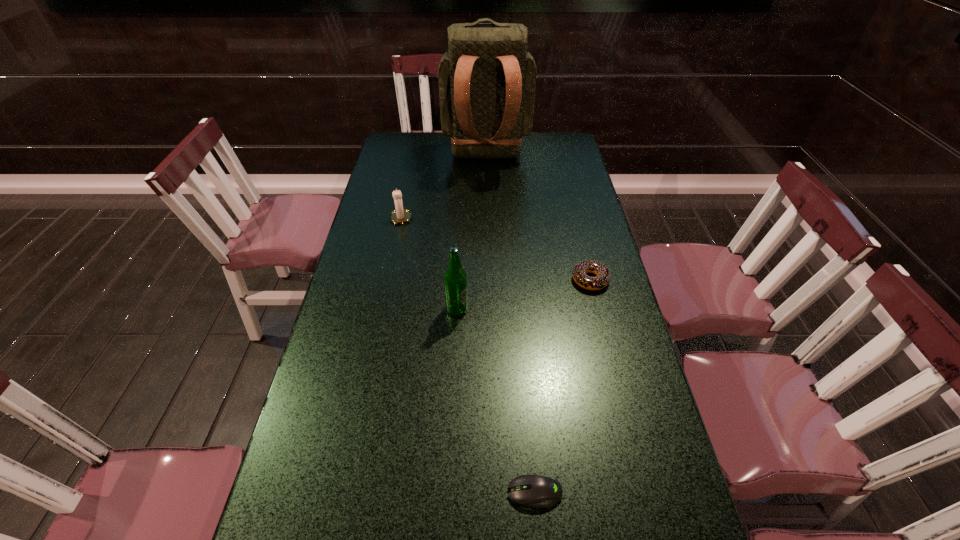
Identify the location of object situated at the left edge. Image resolution: width=960 pixels, height=540 pixels. (399, 216).

You are a GUI agent. You are given a task and a screenshot of the screen. Output one action in this format:
    pyautogui.click(x=<x>, y=<y>)
    Task: Click on the object located at the right edge
    Image resolution: width=960 pixels, height=540 pixels.
    Given the screenshot: What is the action you would take?
    pyautogui.click(x=579, y=272)

Where is `vacant region at the far edge of the desktop`? The image size is (960, 540). vacant region at the far edge of the desktop is located at coordinates (436, 154).

In the image, there is a desktop. Where is `free space at the left edge`? free space at the left edge is located at coordinates (323, 485).

Where is `vacant space at the right edge of the desktop`? vacant space at the right edge of the desktop is located at coordinates (588, 194).

Image resolution: width=960 pixels, height=540 pixels. In the image, there is a desktop. What are the coordinates of `free region at the far left corner` in the screenshot? It's located at (402, 155).

Locate an element on the screen. This screenshot has height=540, width=960. free space between the candle holder and the third farthest object is located at coordinates (495, 248).

Locate an element on the screen. Image resolution: width=960 pixels, height=540 pixels. free space between the shortest object and the fourth shortest object is located at coordinates (495, 401).

You are a GUI agent. You are given a task and a screenshot of the screen. Output one action in this format:
    pyautogui.click(x=<x>, y=<y>)
    Task: Click on the blank region between the candle holder and the nearest object
    
    Given the screenshot: What is the action you would take?
    pyautogui.click(x=468, y=354)

Locate an element on the screen. free area in between the nearest object and the second tallest object is located at coordinates (495, 401).